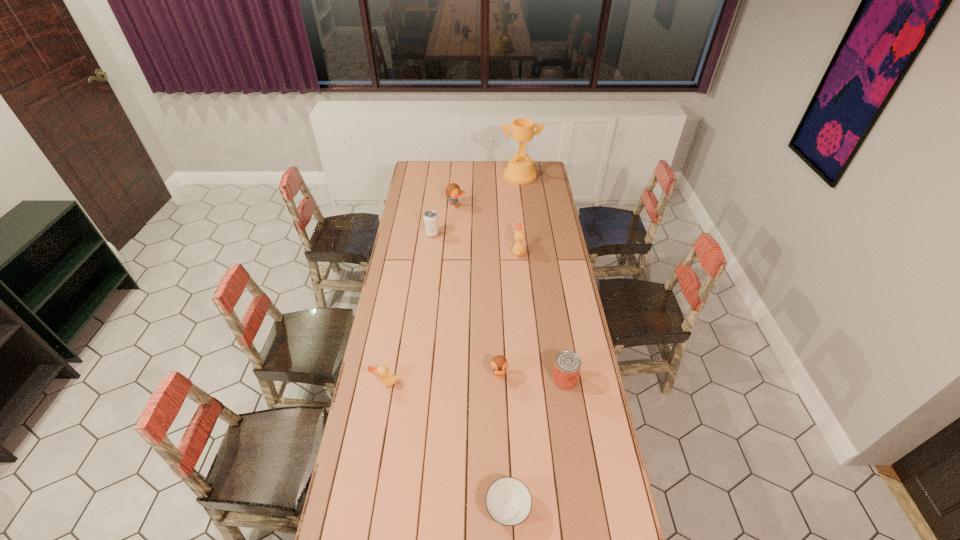
The height and width of the screenshot is (540, 960). Identify the location of beige award. point(520,170).

Where is `the tallest object`? This screenshot has height=540, width=960. the tallest object is located at coordinates (520, 170).

Identify the location of the third duck from right to left. (453, 191).

This screenshot has height=540, width=960. I want to click on the left blue duck, so click(453, 191).

You are a GUI agent. You are given a task and a screenshot of the screen. Output one action in this format:
    pyautogui.click(x=<x>, y=<y>)
    Task: Click on the right tan duck
    
    Given the screenshot: What is the action you would take?
    pyautogui.click(x=518, y=250)

Find the location of a particular element. The height and width of the screenshot is (540, 960). the bigger tan duck is located at coordinates (518, 250).

I want to click on the third farthest object, so click(x=431, y=226).

This screenshot has width=960, height=540. In order to click on the second object from left to right in this screenshot , I will do `click(431, 226)`.

Where is `can`? can is located at coordinates (567, 365).

You are a GUI agent. You are given a task and a screenshot of the screen. Output one action in this format:
    pyautogui.click(x=<x>, y=<y>)
    Task: Click on the smaller blue duck
    
    Given the screenshot: What is the action you would take?
    pyautogui.click(x=499, y=364)